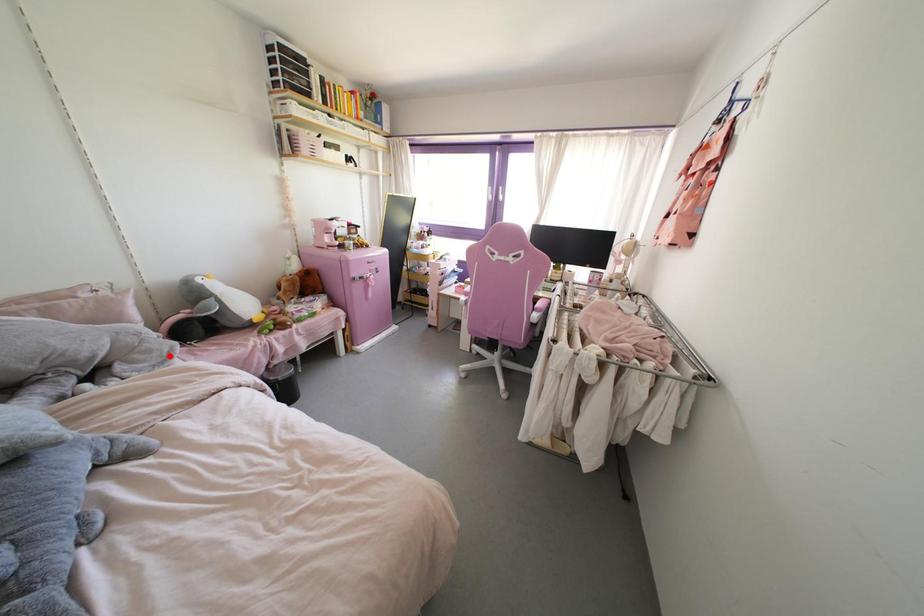
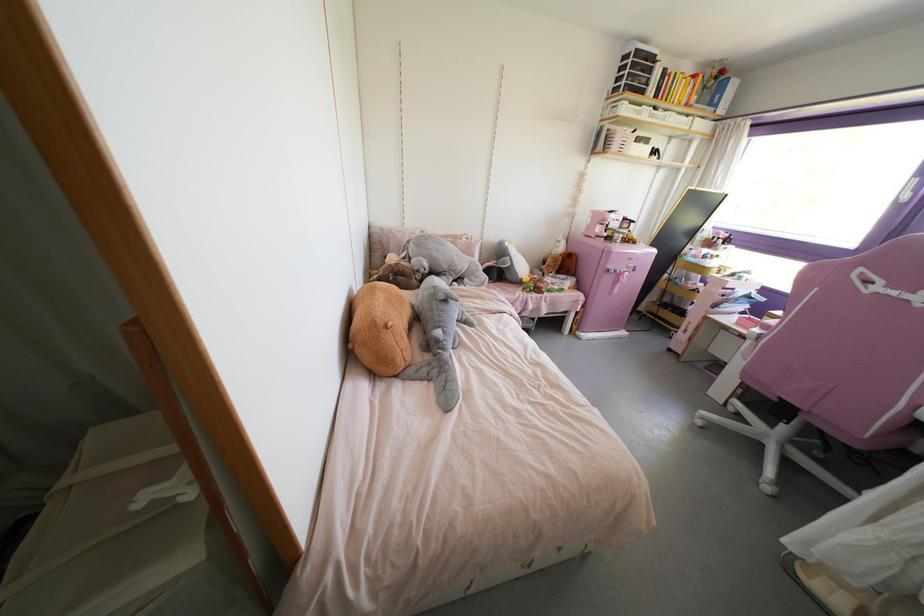
The point at the highlighted location is marked in the first image. Where is the corresponding point in the second image?

(482, 284)